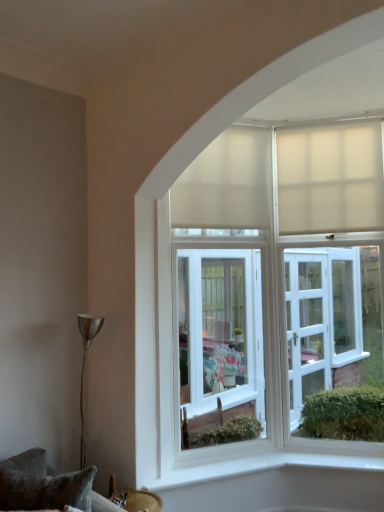
I want to click on vacant region above beige matte curtain at upper right, which is the first curtain from right to left (from a real-world perspective), so click(327, 124).